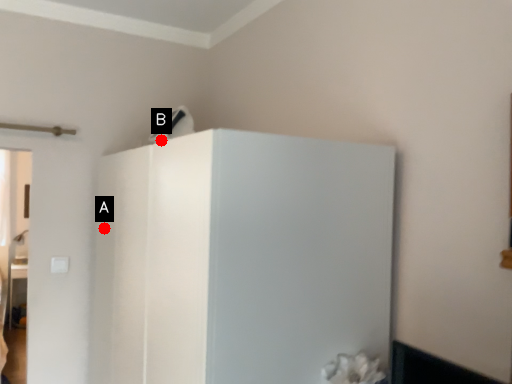
Question: Two points are circled on the image, labeled by A and B beside each circle. Among these points, which one is farthest from the camera?

Choices:
 (A) A is further
 (B) B is further

Answer: (B)